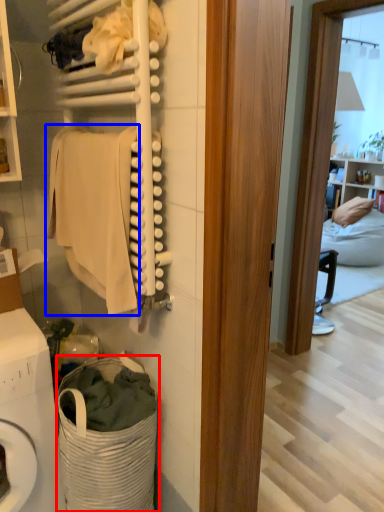
Question: Which point is further to the camera, laundry basket (highlighted by a red box) or clothing (highlighted by a blue box)?

Choices:
 (A) laundry basket
 (B) clothing

Answer: (A)